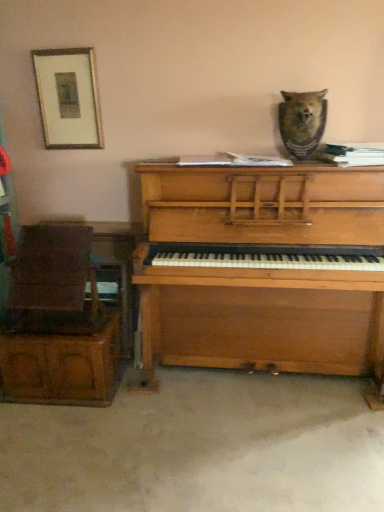
Question: Can you confirm if wooden piano at center is shorter than wooden chair at left?

Choices:
 (A) yes
 (B) no

Answer: (B)

Question: Can you confirm if wooden piano at center is smaller than wooden chair at left?

Choices:
 (A) no
 (B) yes

Answer: (A)

Question: Is wooden piano at center closer to camera compared to wooden chair at left?

Choices:
 (A) no
 (B) yes

Answer: (B)

Question: From a real-world perspective, is wooden piano at center on wooden chair at left?

Choices:
 (A) yes
 (B) no

Answer: (A)

Question: Is wooden piano at center positioned far away from wooden chair at left?

Choices:
 (A) yes
 (B) no

Answer: (B)

Question: Can you confirm if wooden piano at center is bigger than wooden chair at left?

Choices:
 (A) no
 (B) yes

Answer: (B)

Question: From a real-world perspective, is brown fur bear at upper center over wooden chair at left?

Choices:
 (A) yes
 (B) no

Answer: (A)

Question: Does brown fur bear at upper center lie behind wooden chair at left?

Choices:
 (A) no
 (B) yes

Answer: (A)

Question: Is brown fur bear at upper center smaller than wooden chair at left?

Choices:
 (A) yes
 (B) no

Answer: (A)

Question: Is brown fur bear at upper center outside of wooden chair at left?

Choices:
 (A) yes
 (B) no

Answer: (A)

Question: Considering the relative sizes of brown fur bear at upper center and wooden chair at left in the image provided, is brown fur bear at upper center bigger than wooden chair at left?

Choices:
 (A) yes
 (B) no

Answer: (B)

Question: Does brown fur bear at upper center contain wooden chair at left?

Choices:
 (A) yes
 (B) no

Answer: (B)

Question: Are wooden picture frame at upper left and brown fur bear at upper center beside each other?

Choices:
 (A) yes
 (B) no

Answer: (B)